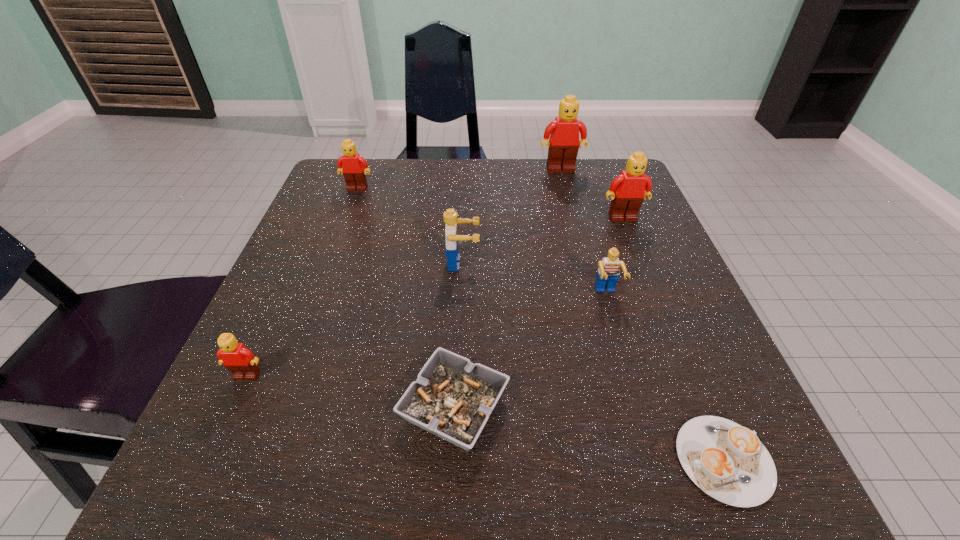
This screenshot has width=960, height=540. What are the coordinates of `the farthest brown Lego` in the screenshot? It's located at (563, 145).

You are a GUI agent. You are given a task and a screenshot of the screen. Output one action in this format:
    pyautogui.click(x=<x>, y=<y>)
    Task: Click on the farthest object
    This screenshot has height=540, width=960.
    Given the screenshot: What is the action you would take?
    pyautogui.click(x=563, y=145)

This screenshot has width=960, height=540. Find the location of `the third farthest brown Lego`. the third farthest brown Lego is located at coordinates (628, 189).

The width and height of the screenshot is (960, 540). I want to click on the second biggest brown Lego, so click(x=628, y=189).

Locate an element on the screen. the bigger blue Lego is located at coordinates (450, 217).

At what (x,y) coordinates should I click in order to perform the action: click on the left blue Lego. Please return your answer as a coordinate pair (x, y). The image size is (960, 540). Looking at the image, I should click on (450, 217).

Where is `the seventh nearest object`? This screenshot has width=960, height=540. the seventh nearest object is located at coordinates (353, 166).

The image size is (960, 540). Find the location of `the third nearest brown Lego`. the third nearest brown Lego is located at coordinates (353, 166).

Locate an element on the screen. The width and height of the screenshot is (960, 540). the second nearest Lego is located at coordinates (608, 272).

Find the location of a particular element. the nearer blue Lego is located at coordinates (608, 272).